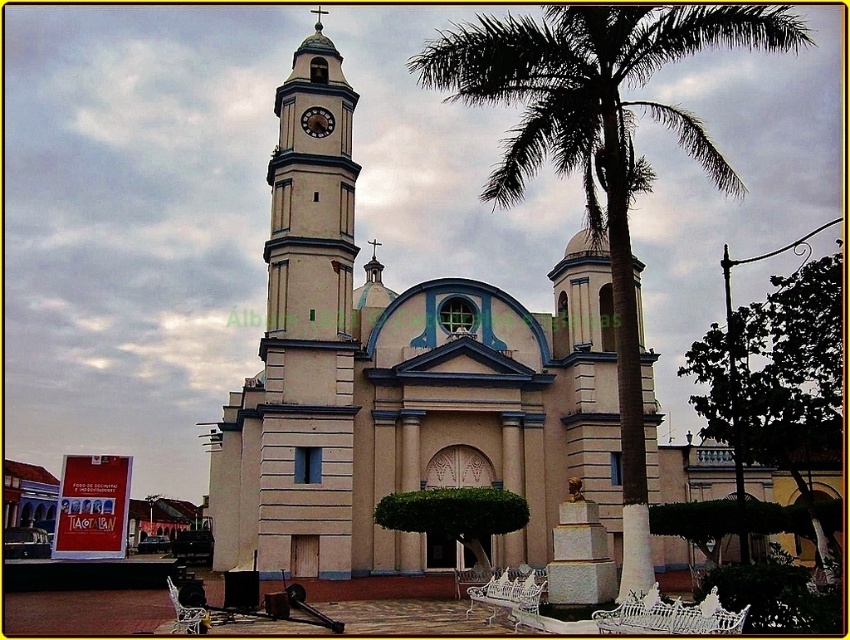
Is white smooth clock tower at upper left smaller than wooden clock at center?

No.

Which is behind, point (333, 234) or point (330, 131)?

The point (330, 131) is behind.

Between point (276, 198) and point (323, 122), which one is positioned in front?

Point (276, 198) is more forward.

Find the location of `white smooth clock tower at upper left`. white smooth clock tower at upper left is located at coordinates (310, 198).

Describe the element at coordinates (599, 147) in the screenshot. This screenshot has width=850, height=640. I see `green leafy palm tree at center` at that location.

Measure the distance from green leafy palm tree at center to white smooth clock tower at upper left.

A distance of 68.65 feet exists between green leafy palm tree at center and white smooth clock tower at upper left.

This screenshot has width=850, height=640. I want to click on green leafy palm tree at center, so click(x=599, y=147).

Between green leafy palm tree at center and wooden clock at center, which one is positioned lower?

wooden clock at center is lower down.

Who is positioned more to the right, green leafy palm tree at center or wooden clock at center?

green leafy palm tree at center is more to the right.

Which is in front, point (749, 44) or point (323, 109)?

Point (749, 44) is more forward.

The width and height of the screenshot is (850, 640). I want to click on green leafy palm tree at center, so click(599, 147).